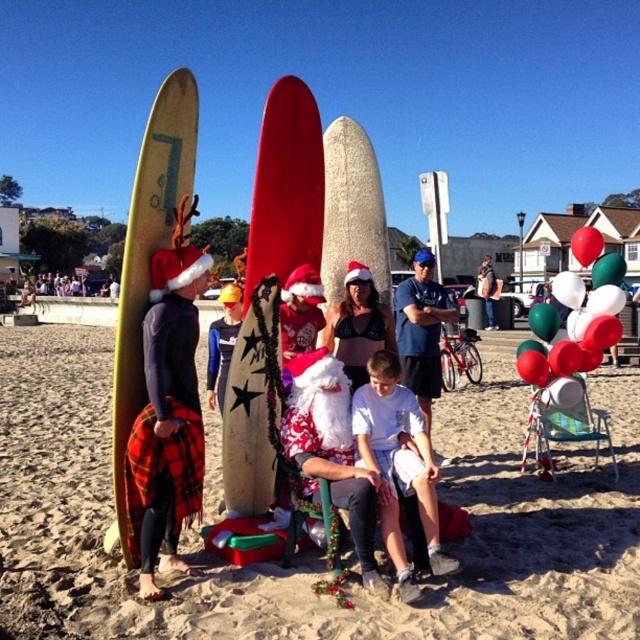
You are a photographer trying to capture the perfect shot of the white cotton shirt at center. The camera is positioned at point A, which has coordinates of 0.5, 0.5. To ensure the shirt is in focus, you need to adjust the camera to the same horizontal or vertical position. Which coordinate axis should you align with the shirt and what adjustment is needed?

The white cotton shirt at center is located at point (397,460). The camera is at (320,320). To align horizontally, adjust the x coordinate from 0.5 to 0.719. To align vertically, adjust the y coordinate from 0.5 to 0.623. Either adjustment will bring the shirt into focus depending on desired framing.

You are organizing a beach cleanup and need to place two shirts into a small bag. The white cotton shirt at center and the blue fabric shirt at center are both on the sand. Which shirt should you choose to fit into the bag without folding?

The white cotton shirt at center occupies less space than the blue fabric shirt at center, so you should choose the white cotton shirt at center to fit into the bag without folding.

You are standing at the Santa figure and want to move towards the two points marked in the image. Which point, point (600, 632) or point (342, 362), is closer to you?

Point (600, 632) is closer to the viewer than point (342, 362), so you should go towards point (600, 632) first.